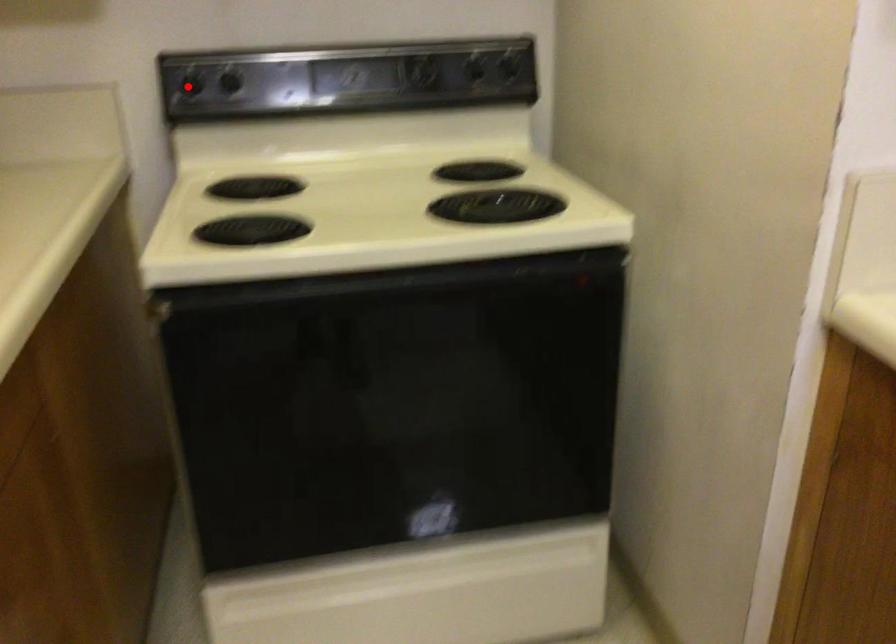
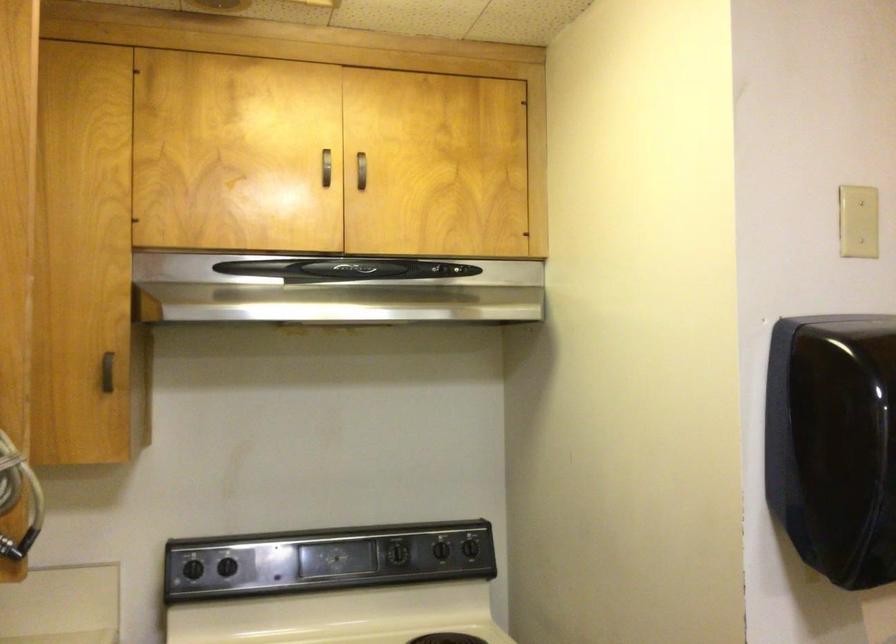
Where in the second image is the point corresponding to the highlighted location from the first image?

(193, 569)